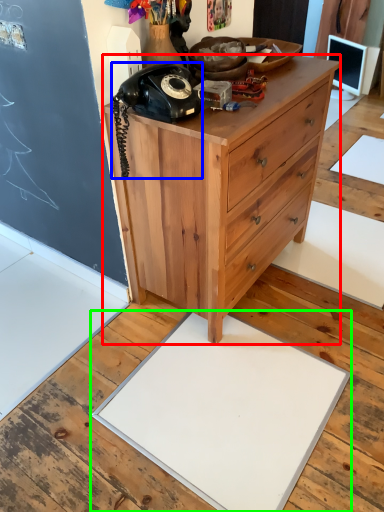
Question: Based on their relative distances, which object is nearer to chest of drawers (highlighted by a red box)? Choose from corded phone (highlighted by a blue box) and slate (highlighted by a green box).

Choices:
 (A) corded phone
 (B) slate

Answer: (A)